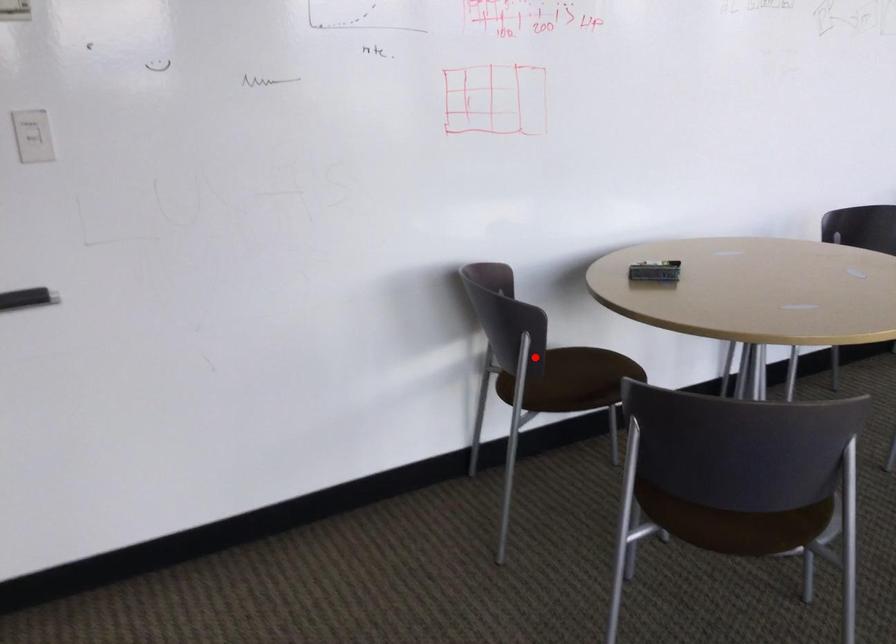
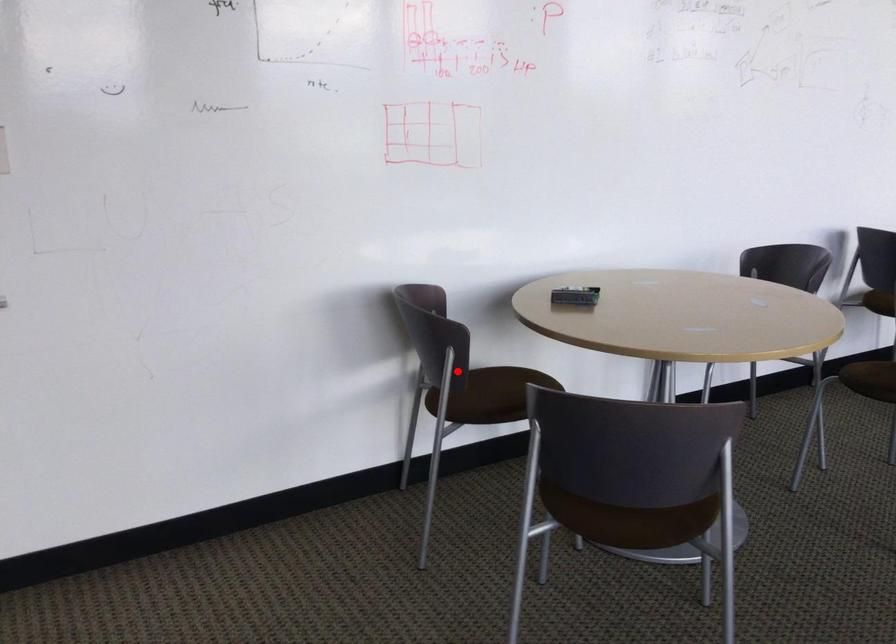
I am providing you with two images of the same scene from different viewpoints. A red point is marked on the first image and another point is marked on the second image. Are the points marked in image1 and image2 representing the same 3D position?

Yes